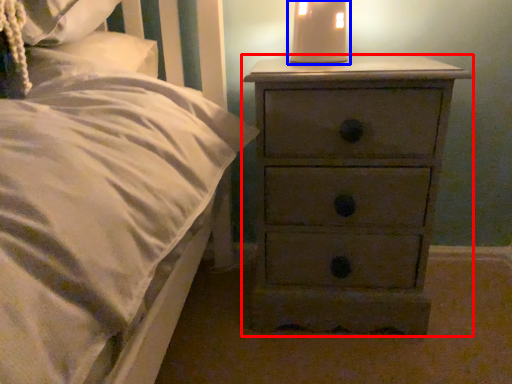
Question: Among these objects, which one is farthest to the camera, chest of drawers (highlighted by a red box) or bedside lamp (highlighted by a blue box)?

Choices:
 (A) chest of drawers
 (B) bedside lamp

Answer: (B)